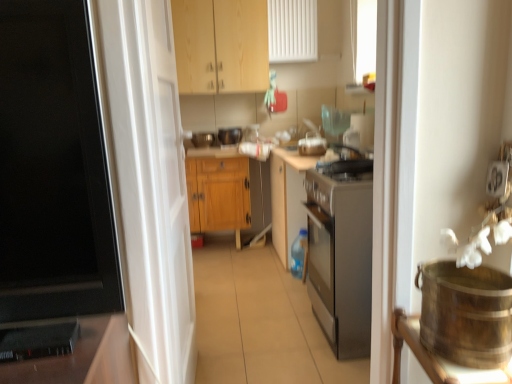
You are a GUI agent. You are given a task and a screenshot of the screen. Output one action in this format:
    pyautogui.click(x=<x>, y=<y>)
    Task: Click on the vacant space in wooden cabinet at center, which is the second cabinetry in top-to-bottom order (from a real-world perspective)
    This screenshot has height=384, width=512.
    Given the screenshot: What is the action you would take?
    pyautogui.click(x=214, y=246)